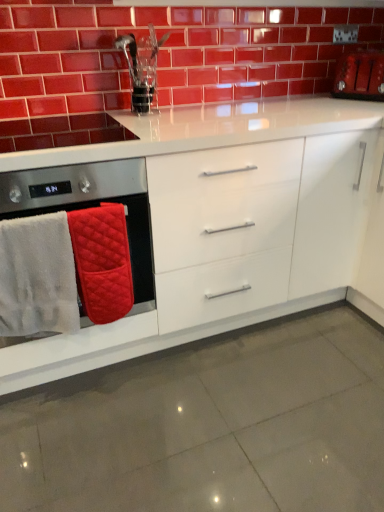
Identify the location of vacant space situated on the left part of matte red toaster at upper right. (312, 99).